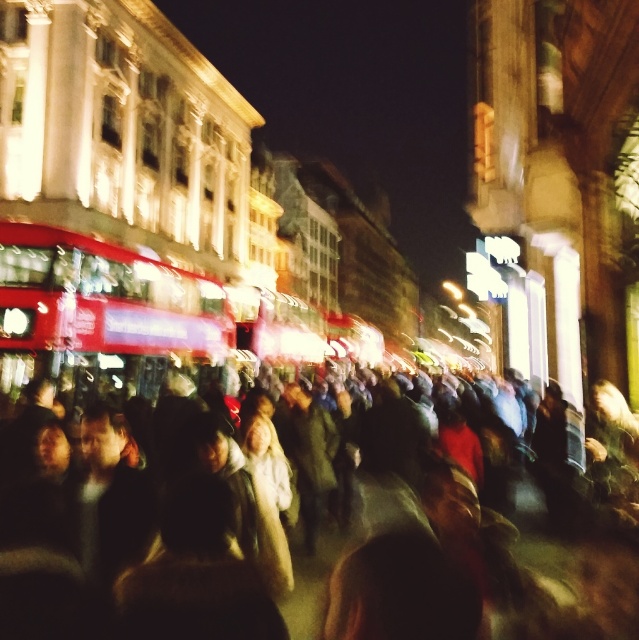
Question: Can you confirm if multicolored fabric crowd at center is positioned above red metallic bus at center?

Choices:
 (A) no
 (B) yes

Answer: (A)

Question: Which of the following is the closest to the observer?

Choices:
 (A) (180, 292)
 (B) (54, 492)

Answer: (B)

Question: Which point appears farthest from the camera in this image?

Choices:
 (A) (121, 264)
 (B) (484, 548)

Answer: (A)

Question: Does multicolored fabric crowd at center appear under red metallic bus at center?

Choices:
 (A) yes
 (B) no

Answer: (A)

Question: Is multicolored fabric crowd at center thinner than red metallic bus at center?

Choices:
 (A) no
 (B) yes

Answer: (A)